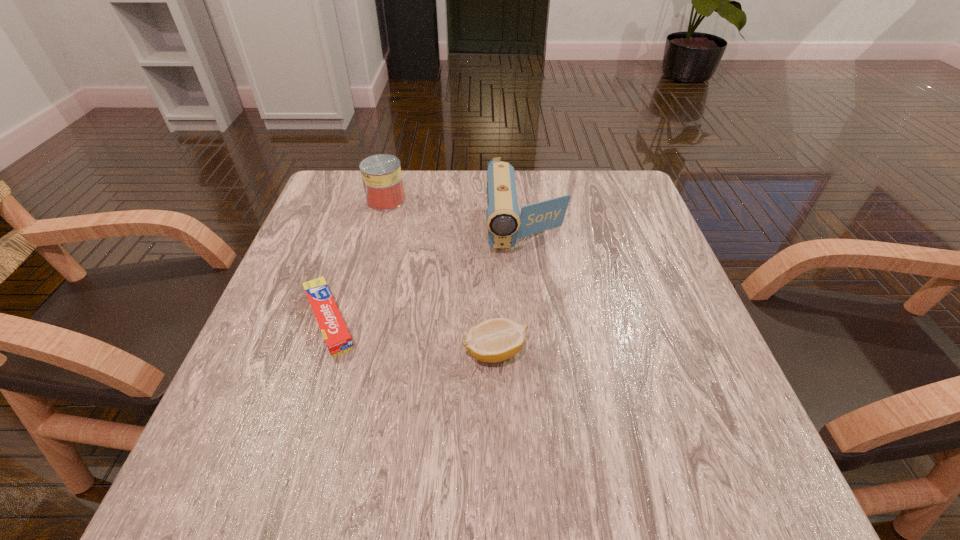
Find the location of a particular element. free space between the camcorder and the lemon is located at coordinates pos(511,291).

I want to click on vacant space that's between the can and the camcorder, so click(x=456, y=215).

The image size is (960, 540). What are the coordinates of `vacant space that is in between the lemon and the can` in the screenshot? It's located at (441, 276).

Locate an element on the screen. The image size is (960, 540). vacant space that is in between the tallest object and the shortest object is located at coordinates (428, 275).

Identify the location of free space between the tallest object and the second shortest object. (511, 291).

Where is `vacant area that lies between the shortest object and the third shortest object`? The image size is (960, 540). vacant area that lies between the shortest object and the third shortest object is located at coordinates (358, 260).

The image size is (960, 540). Find the location of `empty space between the toothpaste and the lemon`. empty space between the toothpaste and the lemon is located at coordinates (412, 336).

Find the location of `free space between the tallest object and the toothpaste`. free space between the tallest object and the toothpaste is located at coordinates (428, 275).

The image size is (960, 540). Identify the location of object that is the second closest to the camcorder. (381, 174).

Identify which object is located as the second nearest to the tallest object. Please provide its 2D coordinates. Your answer should be formatted as a tuple, i.e. [(x, y)], where the tuple contains the x and y coordinates of a point satisfying the conditions above.

[(381, 174)]